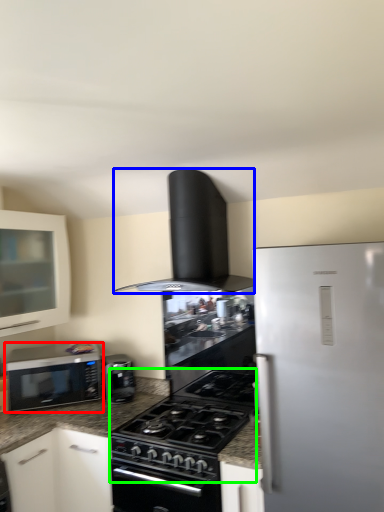
Question: Based on their relative distances, which object is nearer to microwave oven (highlighted by a red box)? Choose from home appliance (highlighted by a blue box) and gas stove (highlighted by a green box).

Choices:
 (A) home appliance
 (B) gas stove

Answer: (B)